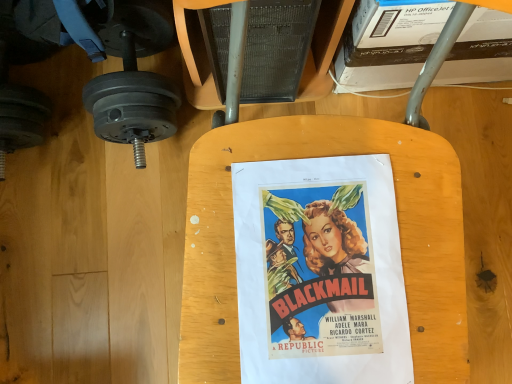
The width and height of the screenshot is (512, 384). I want to click on free location in front of matte black dumbbell at left, so click(109, 219).